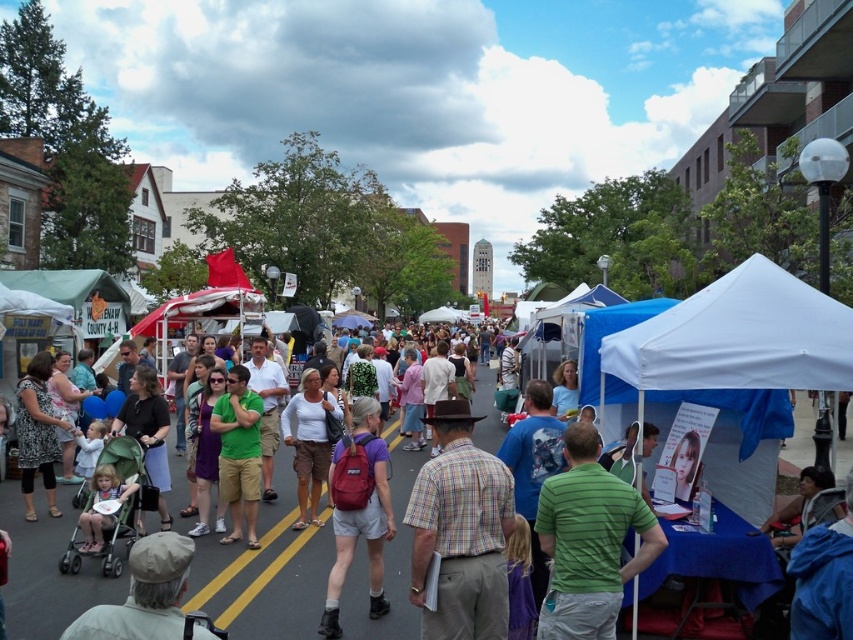
You are a photographer at the event and want to capture both the green cotton shirt at center and the matte white shirt at center in a single photo. Which shirt should you focus on first to ensure both are in frame?

The green cotton shirt at center is below the matte white shirt at center, so you should focus on the matte white shirt at center first to ensure both are in frame.

You are a photographer standing at the camera position. You want to capture a photo of the plaid cotton shirt at center. Can you reach it without moving the camera? The camera has a zoom lens with a maximum zoom range of 100 meters. Please explain your reasoning.

The plaid cotton shirt at center and camera are 7.09 meters apart. Since the camera has a maximum zoom range of 100 meters, which is greater than the distance between them, you can zoom in and capture the plaid cotton shirt at center without moving the camera.

You are a photographer trying to capture a clear shot of both the plaid cotton shirt at center and the green cotton shirt at center. Since you can only focus on one shirt at a time, which shirt should you focus on to ensure the other is still in the background?

You should focus on the plaid cotton shirt at center because it is positioned over the green cotton shirt at center, meaning the green cotton shirt at center will be visible in the background.